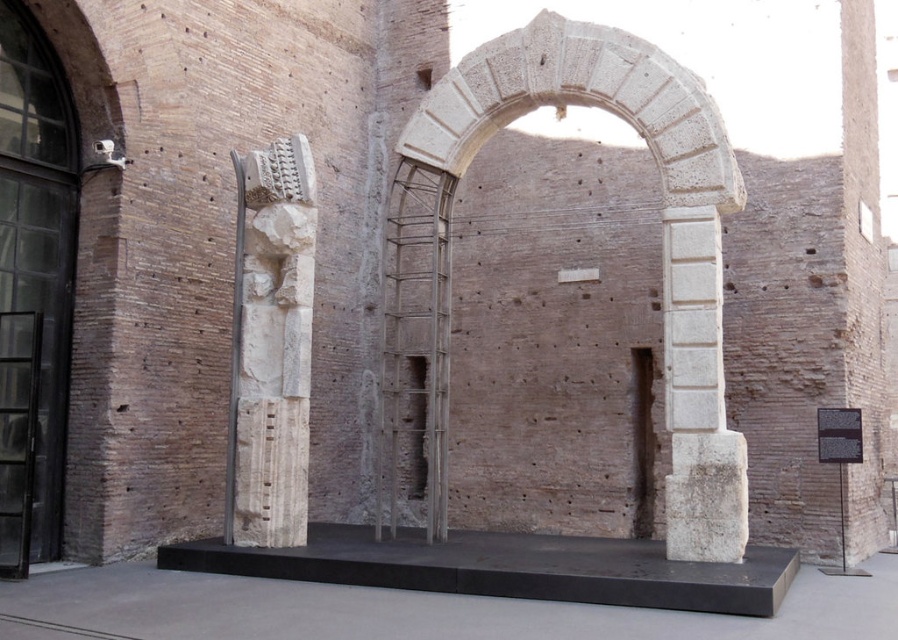
Question: Which of these objects is positioned farthest from the white stone archway at center?

Choices:
 (A) white marble statue at center
 (B) white stone column at center

Answer: (A)

Question: Among these objects, which one is nearest to the camera?

Choices:
 (A) white stone column at center
 (B) white stone archway at center

Answer: (A)

Question: Is white stone archway at center above white stone column at center?

Choices:
 (A) yes
 (B) no

Answer: (A)

Question: Considering the real-world distances, which object is farthest from the white marble statue at center?

Choices:
 (A) white stone column at center
 (B) white stone archway at center

Answer: (A)

Question: Does white stone archway at center appear on the left side of white marble statue at center?

Choices:
 (A) no
 (B) yes

Answer: (A)

Question: Can you confirm if white marble statue at center is positioned to the right of white stone column at center?

Choices:
 (A) yes
 (B) no

Answer: (B)